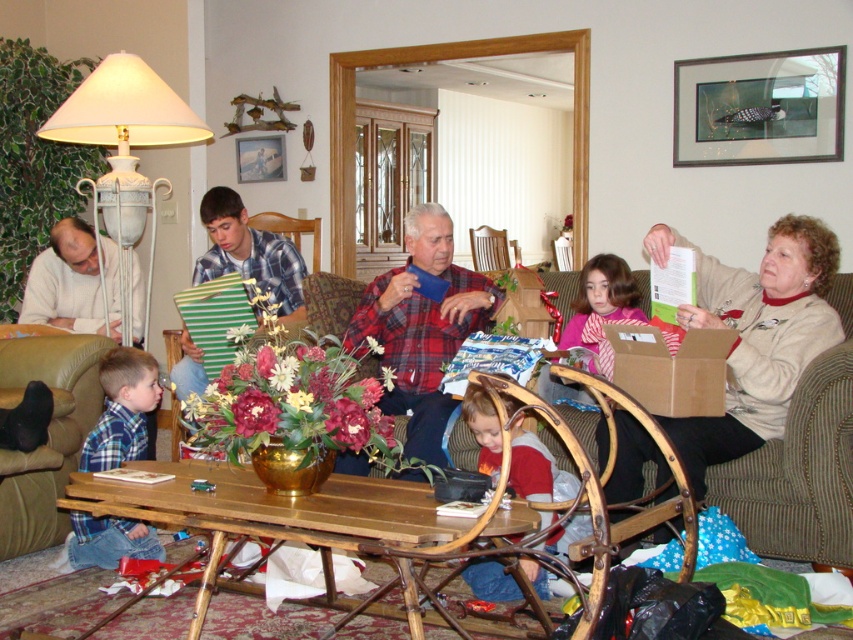
Question: Is beige fabric couch at right closer to camera compared to plaid flannel shirt at center?

Choices:
 (A) yes
 (B) no

Answer: (A)

Question: Considering the real-world distances, which object is farthest from the pink satin scarf at center?

Choices:
 (A) matte blue shirt at center
 (B) plaid flannel shirt at center

Answer: (A)

Question: Estimate the real-world distances between objects in this image. Which object is farther from the plaid flannel shirt at center?

Choices:
 (A) beige fabric couch at right
 (B) pink satin scarf at center
 (C) matte blue shirt at center
 (D) plaid flannel shirt at lower left

Answer: (C)

Question: Is pink satin scarf at center positioned in front of plaid fabric armchair at center?

Choices:
 (A) no
 (B) yes

Answer: (B)

Question: Does plaid flannel shirt at center have a larger size compared to plaid flannel shirt at lower left?

Choices:
 (A) no
 (B) yes

Answer: (B)

Question: Estimate the real-world distances between objects in this image. Which object is closer to the red plaid shirt at lower center?

Choices:
 (A) pink satin scarf at center
 (B) plaid fabric armchair at center
 (C) matte blue shirt at center

Answer: (A)